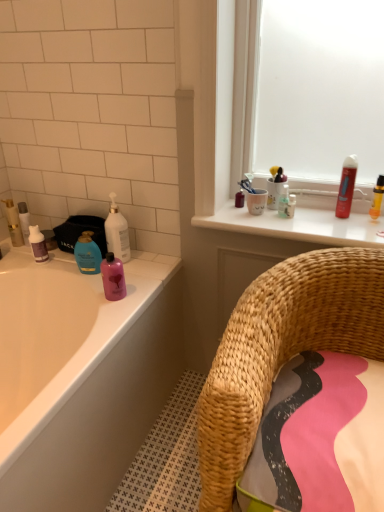
What are the coordinates of `vacant space situated on the left part of translucent yellow bottle at upper right, the 6th toiletry viewed from the left` in the screenshot? It's located at (326, 225).